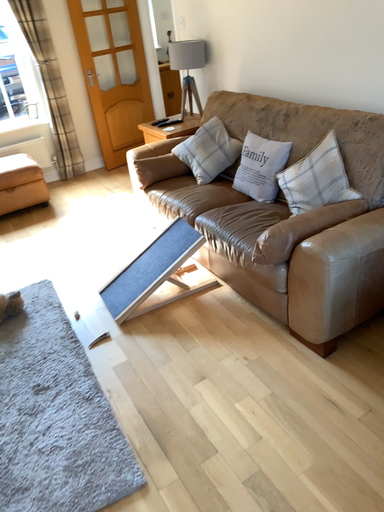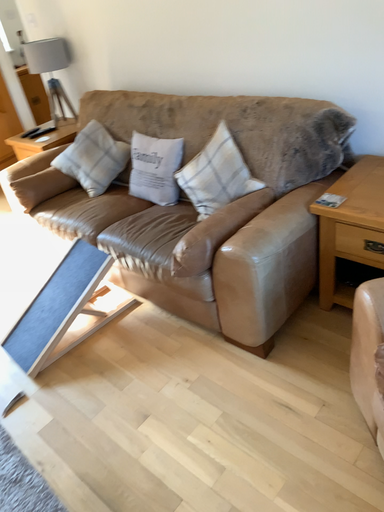
Question: Which way did the camera rotate in the video?

Choices:
 (A) rotated left
 (B) rotated right

Answer: (B)